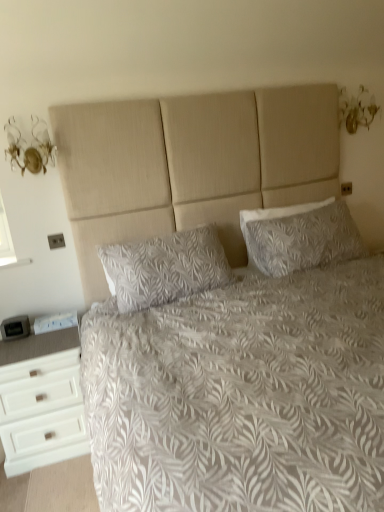
You are a GUI agent. You are given a task and a screenshot of the screen. Output one action in this format:
    pyautogui.click(x=<x>, y=<y>)
    Task: Click on the empty space that is ontop of white matte chest of drawers at lower left
    
    Given the screenshot: What is the action you would take?
    click(x=37, y=334)